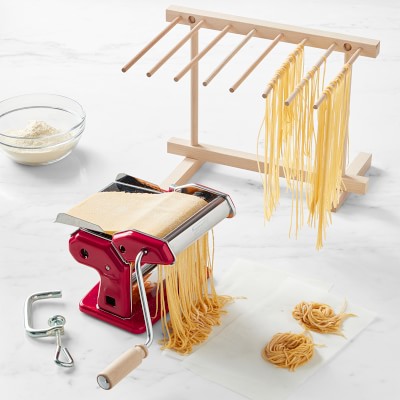
You are a GUI agent. You are given a task and a screenshot of the screen. Output one action in this format:
    pyautogui.click(x=<x>, y=<y>)
    Task: Click on the bowl
    The width and height of the screenshot is (400, 400).
    Given the screenshot: What is the action you would take?
    pyautogui.click(x=77, y=121)